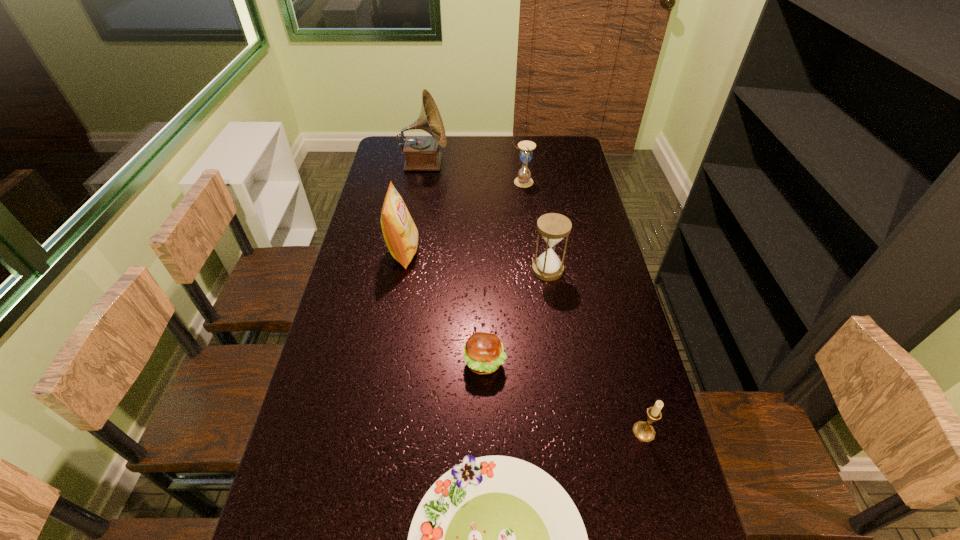
Locate an element on the screen. The image size is (960, 540). blank space located 0.370m on the back of the nearer hourglass is located at coordinates (536, 193).

You are a GUI agent. You are given a task and a screenshot of the screen. Output one action in this format:
    pyautogui.click(x=<x>, y=<y>)
    Task: Click on the vacant area situated 0.310m on the left of the farther hourglass
    Image resolution: width=960 pixels, height=540 pixels.
    Given the screenshot: What is the action you would take?
    pyautogui.click(x=433, y=182)

You are a GUI agent. You are given a task and a screenshot of the screen. Output one action in this format:
    pyautogui.click(x=<x>, y=<y>)
    Task: Click on the vacant space located on the left of the sixth farthest object
    The height and width of the screenshot is (540, 960).
    Given the screenshot: What is the action you would take?
    pyautogui.click(x=578, y=432)

Find the location of `vacant point located 0.340m on the right of the third nearest object`. vacant point located 0.340m on the right of the third nearest object is located at coordinates (633, 363).

I want to click on object present at the far edge, so click(421, 153).

Identify the location of phonograph record present at the left edge. Image resolution: width=960 pixels, height=540 pixels. (421, 153).

This screenshot has width=960, height=540. Identify the location of crisp (potato chip) present at the left edge. (400, 233).

This screenshot has width=960, height=540. I want to click on hourglass that is at the right edge, so click(x=553, y=227).

Image resolution: width=960 pixels, height=540 pixels. Find the location of `candle holder that is at the right edge`. candle holder that is at the right edge is located at coordinates (643, 431).

Locate an element on the screen. This screenshot has height=540, width=960. object located at the far left corner is located at coordinates (421, 153).